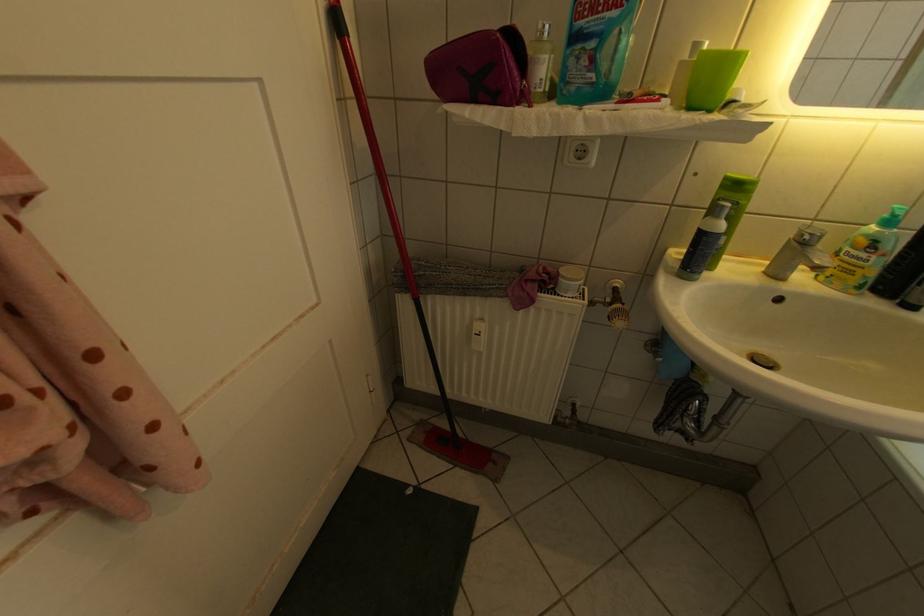
What are the coordinates of `radiator thermostat knob` in the screenshot? It's located at click(617, 315).